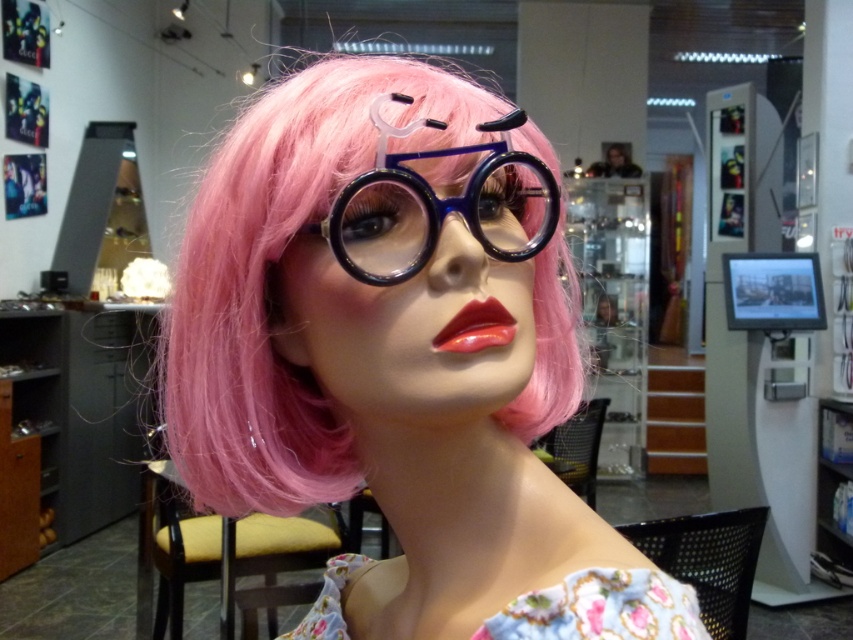
Question: Which is nearer to the translucent plastic glasses at center?

Choices:
 (A) blue plastic goggles at center
 (B) glossy red lips at center

Answer: (A)

Question: Among these objects, which one is farthest from the camera?

Choices:
 (A) blue plastic goggles at center
 (B) translucent plastic glasses at center
 (C) glossy red lips at center

Answer: (C)

Question: Can you confirm if translucent plastic glasses at center is thinner than blue plastic goggles at center?

Choices:
 (A) yes
 (B) no

Answer: (B)

Question: Can you confirm if blue plastic goggles at center is positioned below glossy red lips at center?

Choices:
 (A) no
 (B) yes

Answer: (A)

Question: Which point is closer to the camera taking this photo?

Choices:
 (A) (251, 490)
 (B) (506, 225)

Answer: (B)

Question: Is translucent plastic glasses at center bigger than blue plastic goggles at center?

Choices:
 (A) yes
 (B) no

Answer: (A)